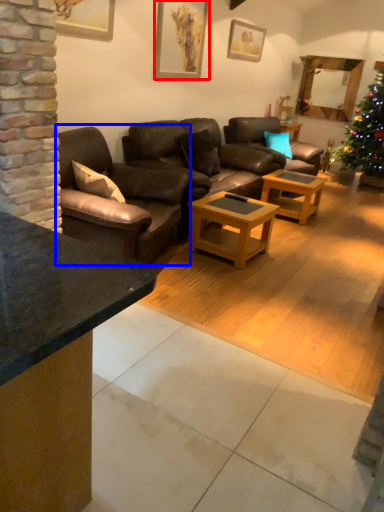
Question: Which point is further to the camera, picture frame (highlighted by a red box) or studio couch (highlighted by a blue box)?

Choices:
 (A) picture frame
 (B) studio couch

Answer: (A)